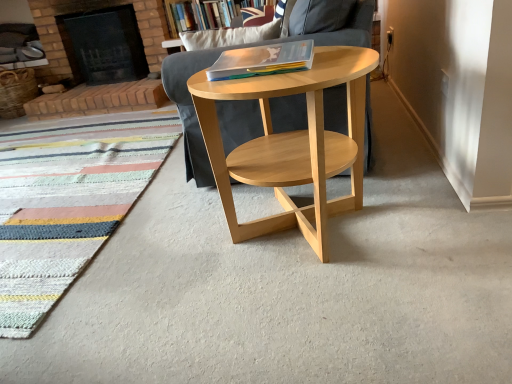
Find the location of a particular element. This screenshot has height=384, width=512. free point above multicolored woven mat at lower left (from a real-world perspective) is located at coordinates (53, 181).